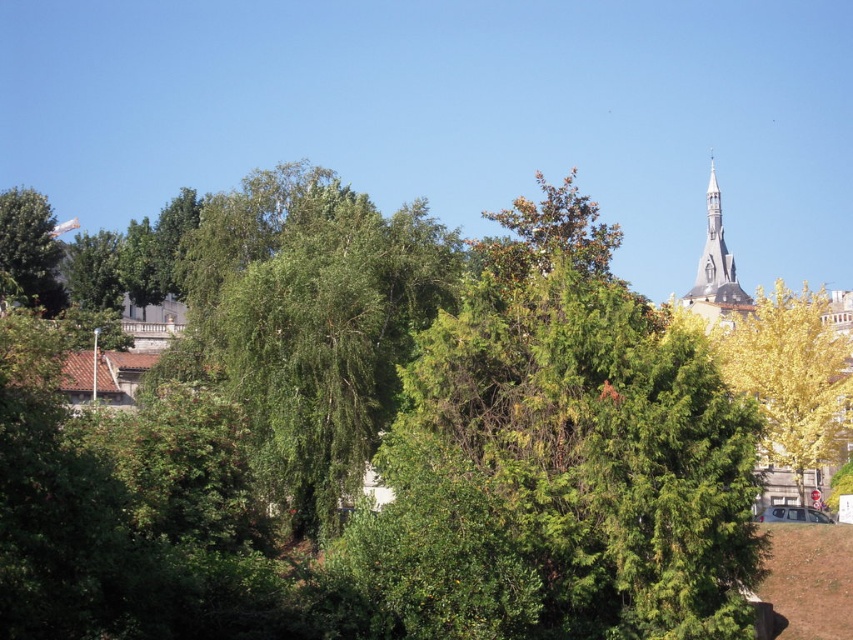
Question: Is yellow/golden leaves at upper right positioned in front of green leafy tree at upper left?

Choices:
 (A) no
 (B) yes

Answer: (B)

Question: Estimate the real-world distances between objects in this image. Which object is closer to the smooth gray stone tower at upper right?

Choices:
 (A) yellow/golden leaves at upper right
 (B) green leafy tree at upper left

Answer: (A)

Question: Can you confirm if yellow/golden leaves at upper right is positioned to the left of green leafy tree at upper left?

Choices:
 (A) yes
 (B) no

Answer: (B)

Question: Estimate the real-world distances between objects in this image. Which object is farther from the yellow/golden leaves at upper right?

Choices:
 (A) green leafy tree at upper left
 (B) smooth gray stone tower at upper right

Answer: (A)

Question: Is green leafy tree at upper left thinner than smooth gray stone tower at upper right?

Choices:
 (A) yes
 (B) no

Answer: (A)

Question: Considering the real-world distances, which object is closest to the green leafy tree at upper left?

Choices:
 (A) smooth gray stone tower at upper right
 (B) yellow/golden leaves at upper right

Answer: (B)